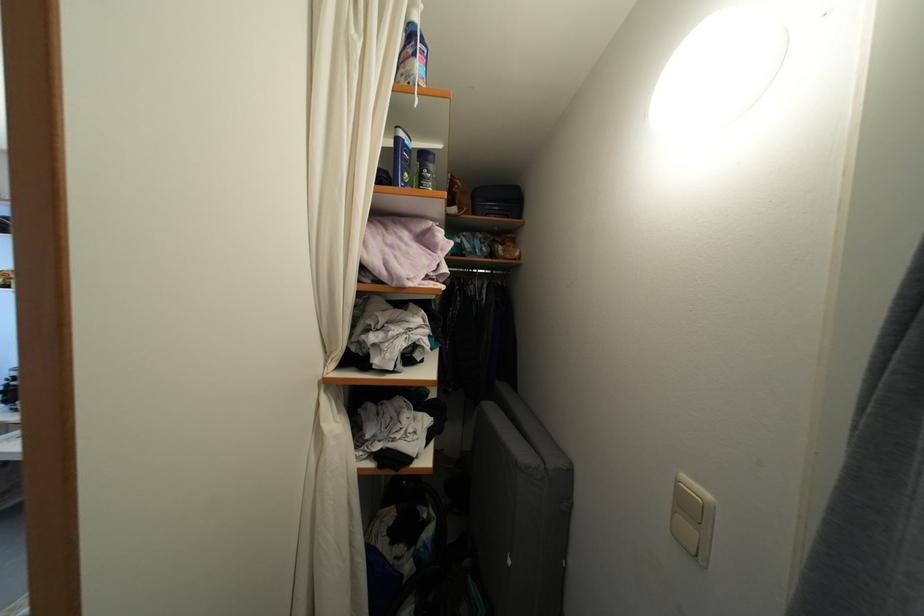
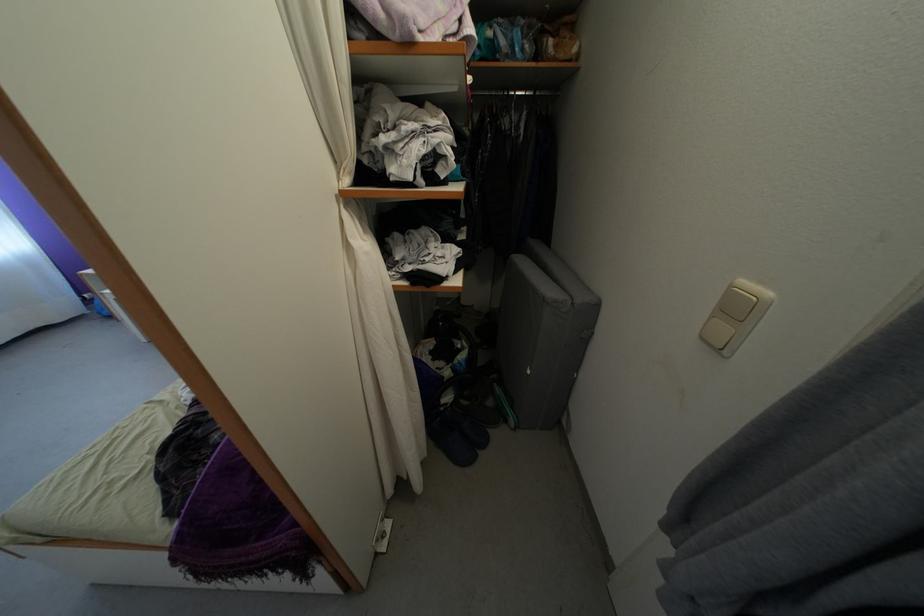
Locate, in the second image, the point that corresponds to point (500, 278) in the first image.

(543, 98)